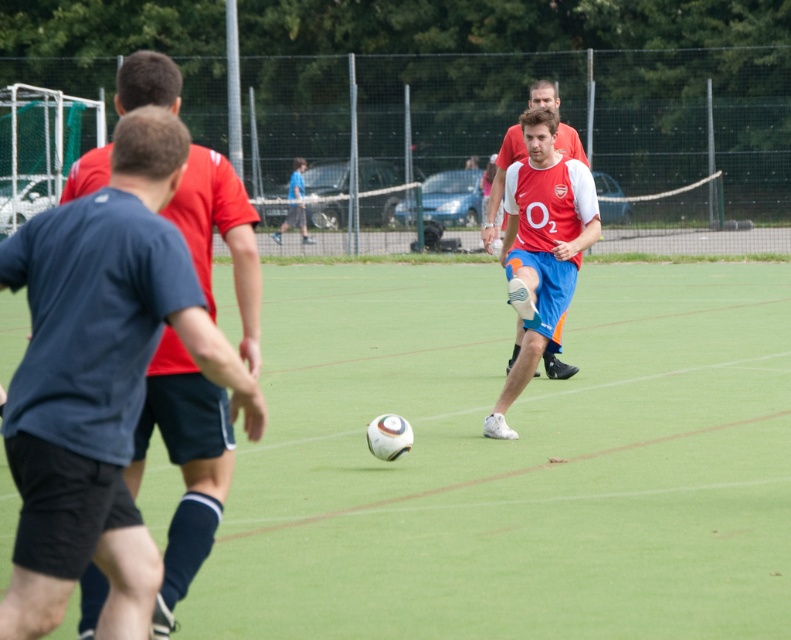
Image resolution: width=791 pixels, height=640 pixels. What do you see at coordinates (513, 461) in the screenshot?
I see `green grass football field at center` at bounding box center [513, 461].

Who is more forward, (424, 316) or (494, 180)?

Point (494, 180) is more forward.

Find the location of a particular element. The image size is (791, 640). green grass football field at center is located at coordinates (513, 461).

Is green grass football field at center smaller than blue cotton shirt at left?

Incorrect, green grass football field at center is not smaller in size than blue cotton shirt at left.

Who is more forward, (267, 506) or (157, 612)?

Point (157, 612)

Locate an element on the screen. Image resolution: width=791 pixels, height=640 pixels. green grass football field at center is located at coordinates (513, 461).

Is point (161, 609) positioned in front of point (577, 144)?

Yes.

Who is more distant from viewer, (127, 81) or (502, 180)?

Positioned behind is point (502, 180).

At what (x,y) coordinates should I click in order to perform the action: click on blue cotton shirt at left. Please return your answer as a coordinate pair (x, y). Looking at the image, I should click on coord(184,464).